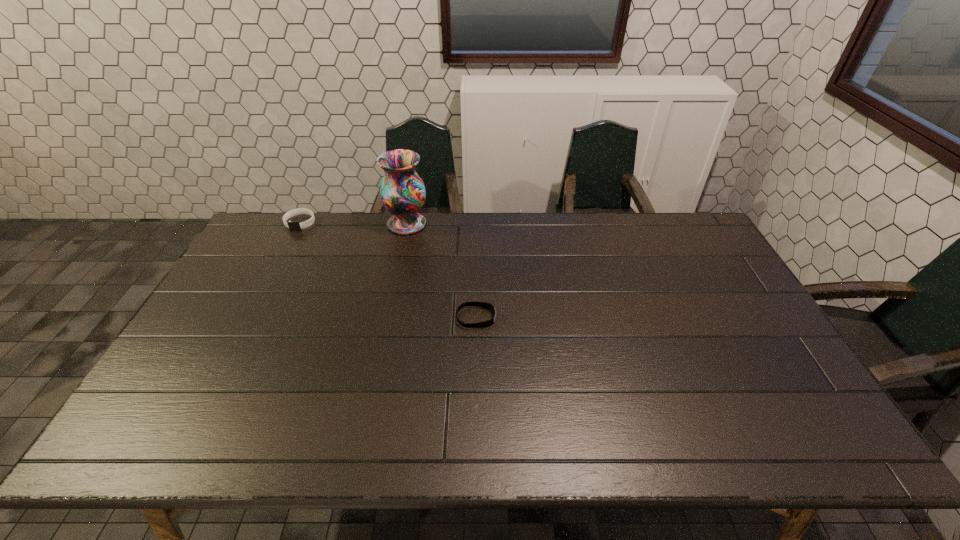
Identify the location of vacant region between the leftmost object and the second object from right to left. (353, 224).

Identify the location of free space that is in between the nearer wristband and the leftmost object. This screenshot has width=960, height=540. (388, 271).

The height and width of the screenshot is (540, 960). I want to click on unoccupied position between the second object from left to right and the leftmost object, so click(353, 224).

You are a GUI agent. You are given a task and a screenshot of the screen. Output one action in this format:
    pyautogui.click(x=<x>, y=<y>)
    Task: Click on the free area in between the second object from right to left and the left wristband
    
    Given the screenshot: What is the action you would take?
    pyautogui.click(x=353, y=224)

Find the location of a particular element. This screenshot has height=540, width=960. free area in between the shortest object and the farther wristband is located at coordinates (388, 271).

Where is `vacant space in between the leftmost object and the shorter wristband`? vacant space in between the leftmost object and the shorter wristband is located at coordinates (388, 271).

Identify the location of free point between the farther wristband and the right wristband. Image resolution: width=960 pixels, height=540 pixels. (388, 271).

Where is `free area in between the left wristband and the nearer wristband`? The height and width of the screenshot is (540, 960). free area in between the left wristband and the nearer wristband is located at coordinates (388, 271).

Locate an element on the screen. The height and width of the screenshot is (540, 960). free space between the shorter wristband and the vase is located at coordinates (442, 271).

This screenshot has width=960, height=540. I want to click on the second closest object to the nearer wristband, so click(292, 225).